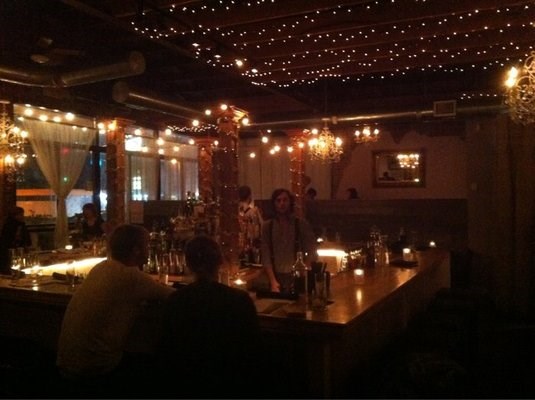
The height and width of the screenshot is (400, 535). I want to click on candles on bar table, so click(x=402, y=249), click(x=358, y=275).